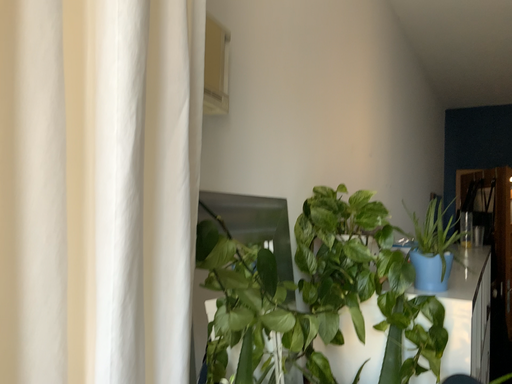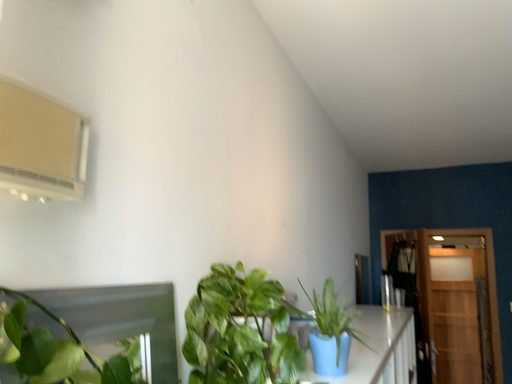
Question: Which way did the camera rotate in the video?

Choices:
 (A) rotated right
 (B) rotated left

Answer: (A)